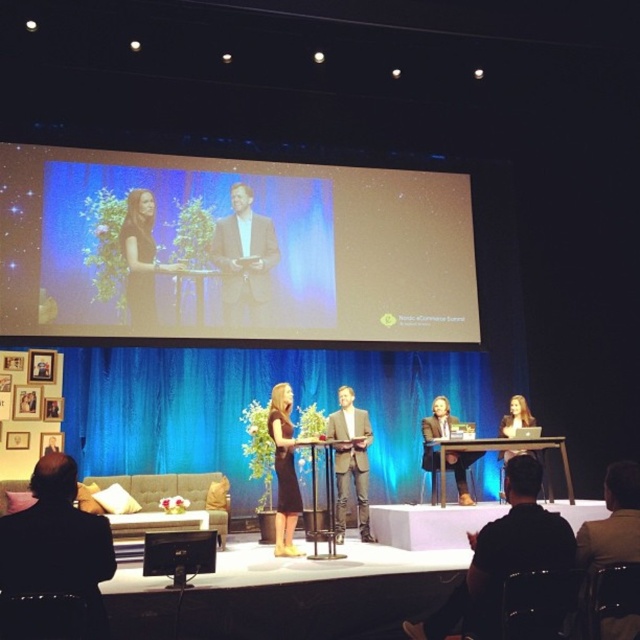
Which of these two, black dress at left or matte black monitor at lower left, stands shorter?

matte black monitor at lower left is shorter.

Can you confirm if black dress at left is positioned below matte black monitor at lower left?

No.

Which is in front, point (141, 268) or point (179, 540)?

Point (179, 540) is more forward.

Locate an element on the screen. The image size is (640, 640). black dress at left is located at coordinates (141, 257).

Based on the photo, is black leather jacket at lower right bigger than light brown leather suit at center?

No, black leather jacket at lower right is not bigger than light brown leather suit at center.

Is point (532, 538) positioned behind point (346, 404)?

That is False.

Is point (496, 588) positioned after point (340, 410)?

No, (496, 588) is closer to viewer.

In order to click on black leather jacket at lower right in this screenshot , I will do `click(502, 556)`.

Who is higher up, brown leather jacket at lower right or metallic silver podium at center?

Positioned higher is brown leather jacket at lower right.

You are a GUI agent. You are given a task and a screenshot of the screen. Output one action in this format:
    pyautogui.click(x=<x>, y=<y>)
    Task: Click on the brown leather jacket at lower right
    
    Given the screenshot: What is the action you would take?
    pyautogui.click(x=609, y=531)